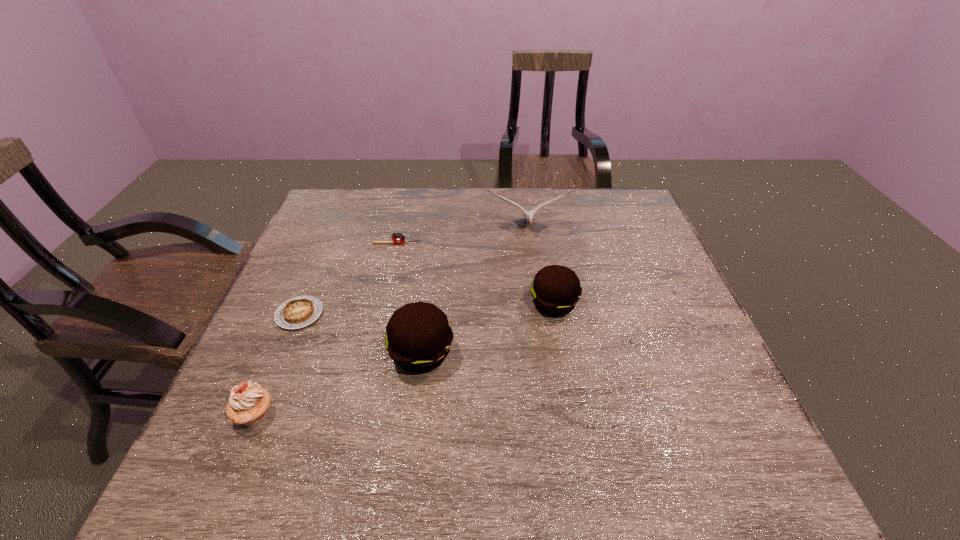
Find the location of `blank space located on the left of the nearer patty`. blank space located on the left of the nearer patty is located at coordinates (280, 354).

Locate an element on the screen. blank space located on the back of the shorter patty is located at coordinates (545, 258).

You are a GUI agent. You are given a task and a screenshot of the screen. Output one action in this format:
    pyautogui.click(x=<x>, y=<y>)
    Task: Click on the free location located on the front of the second shortest object
    Image resolution: width=960 pixels, height=540 pixels.
    Given the screenshot: What is the action you would take?
    pyautogui.click(x=384, y=302)

Find the location of a particular element. Image resolution: width=960 pixels, height=540 pixels. free space located at the tip of the beak of the farthest object is located at coordinates (533, 267).

Locate an element on the screen. Image resolution: width=960 pixels, height=540 pixels. vacant region located 0.100m on the back of the quiche is located at coordinates (317, 272).

Identify the location of vacant space positioned 0.270m on the back of the cupcake. The image size is (960, 540). (301, 302).

Where is `object located at the far edge`? The image size is (960, 540). object located at the far edge is located at coordinates (529, 215).

Where is `object that is at the near edge`? object that is at the near edge is located at coordinates (249, 404).

The image size is (960, 540). In order to click on quiche present at the left edge in this screenshot , I will do `click(297, 312)`.

At what (x,y) coordinates should I click in order to perform the action: click on cupcake situated at the left edge. Please return your answer as a coordinate pair (x, y). The width and height of the screenshot is (960, 540). Looking at the image, I should click on (249, 404).